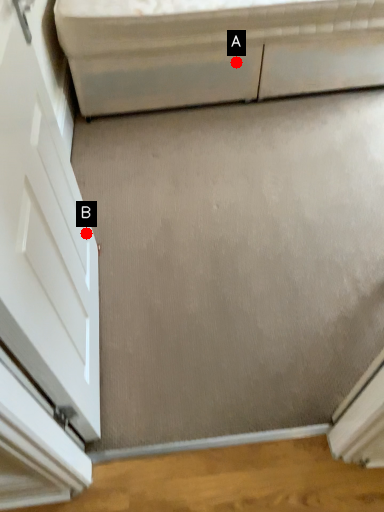
Question: Two points are circled on the image, labeled by A and B beside each circle. Among these points, which one is farthest from the camera?

Choices:
 (A) A is further
 (B) B is further

Answer: (A)